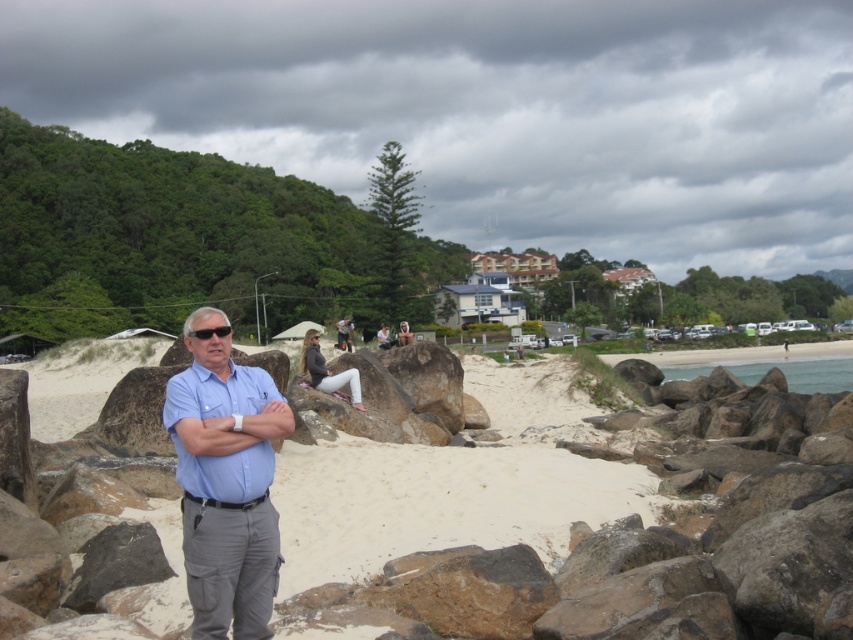
Is blue cotton shirt at center to the left of light blue shirt at center from the viewer's perspective?

Incorrect, blue cotton shirt at center is not on the left side of light blue shirt at center.

Between blue cotton shirt at center and light blue shirt at center, which one has less height?

With less height is light blue shirt at center.

You are a GUI agent. You are given a task and a screenshot of the screen. Output one action in this format:
    pyautogui.click(x=<x>, y=<y>)
    Task: Click on the blue cotton shirt at center
    This screenshot has width=853, height=640.
    Given the screenshot: What is the action you would take?
    pyautogui.click(x=225, y=483)

You are a GUI agent. You are given a task and a screenshot of the screen. Output one action in this format:
    pyautogui.click(x=<x>, y=<y>)
    Task: Click on the blue cotton shirt at center
    Image resolution: width=853 pixels, height=640 pixels.
    Given the screenshot: What is the action you would take?
    pyautogui.click(x=225, y=483)

Is point (770, 548) farther from viewer compared to point (312, 353)?

That is False.

Does point (349, 531) come in front of point (332, 390)?

Yes.

Image resolution: width=853 pixels, height=640 pixels. What are the coordinates of `smooth sand beach at center` in the screenshot? It's located at (575, 518).

Between blue cotton shirt at center and black plastic sunglasses at center, which one appears on the right side from the viewer's perspective?

black plastic sunglasses at center is more to the right.

Is blue cotton shirt at center wider than black plastic sunglasses at center?

Indeed, blue cotton shirt at center has a greater width compared to black plastic sunglasses at center.

Identify the location of blue cotton shirt at center. This screenshot has height=640, width=853. (225, 483).